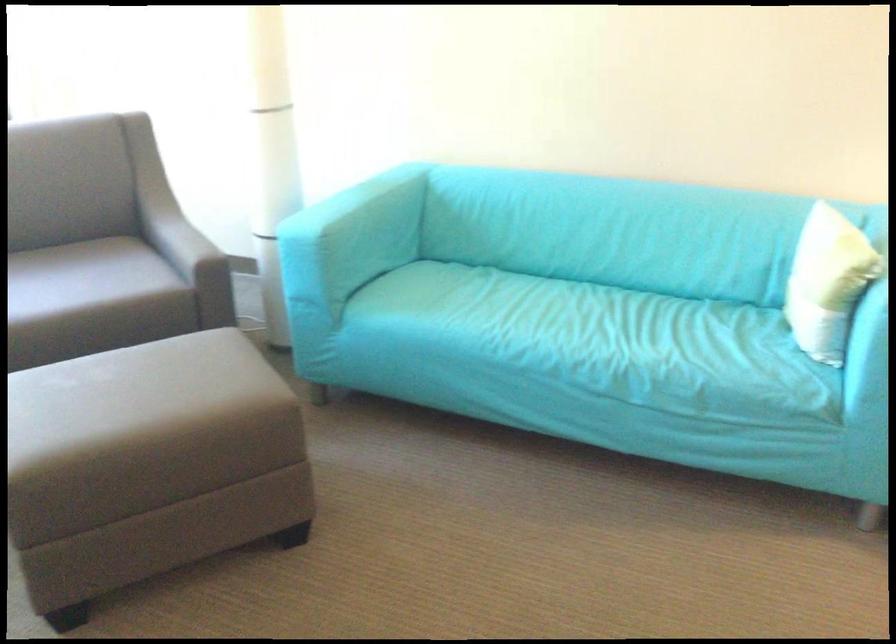
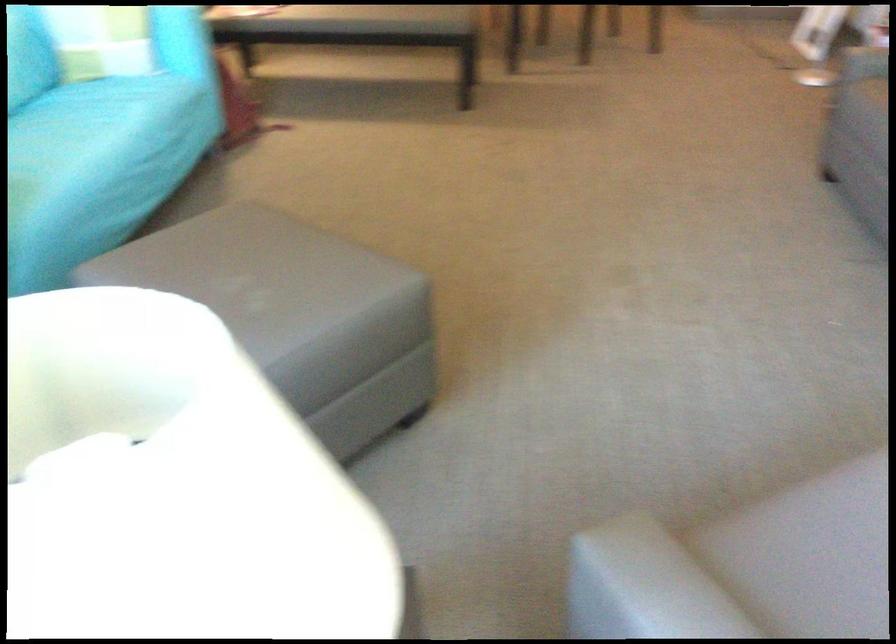
Question: I am providing you with two images of the same scene from different viewpoints. After the viewpoint changes to image2, which objects are now occluded?

Choices:
 (A) striped pillow
 (B) gray ottoman
 (C) blue sofa sitting surface
 (D) none of these

Answer: (D)